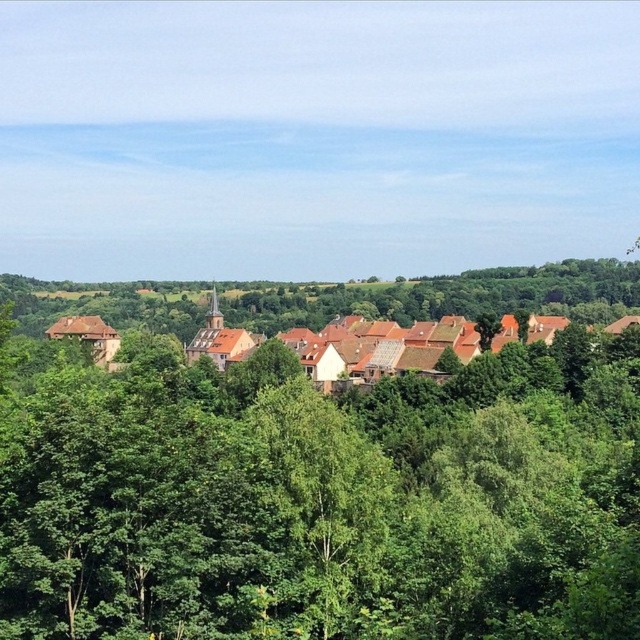
You are a hiker standing at the base of the green leafy tree at center in the village scene. You want to reach the brown clay houses at center. Considering the distance, can you walk directly to them without any obstacles?

The distance between the green leafy tree at center and the brown clay houses at center is 33.32 meters. Since there are no mentioned obstacles in the scene description, you can walk directly to them.

You are a bird flying over the village. You want to land on the brown clay houses at center. Which direction should you fly from the green leafy tree at center to reach them?

The green leafy tree at center is positioned under brown clay houses at center, so you should fly upwards from the green leafy tree at center to reach the brown clay houses at center.

You are standing in the village and want to determine the relative positions of two points marked in the scene. Which point is nearer to you, point (x=376, y=627) or point (x=440, y=317)?

Point (x=376, y=627) is closer to the viewer than point (x=440, y=317).